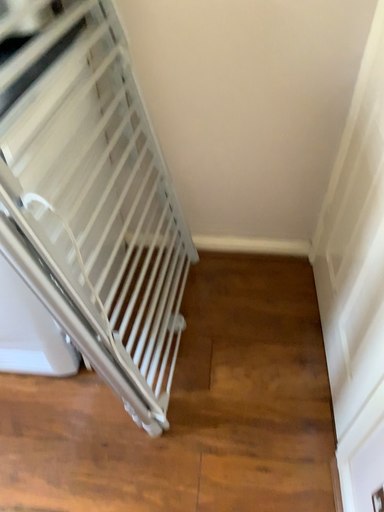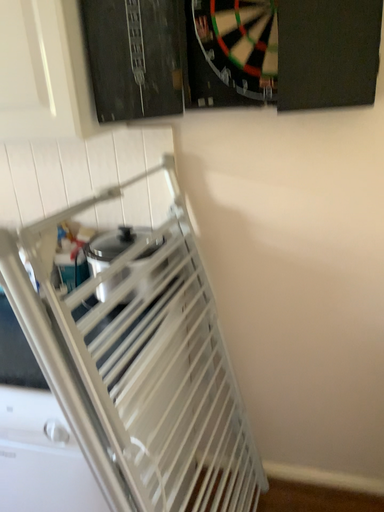
Question: How did the camera likely rotate when shooting the video?

Choices:
 (A) rotated left
 (B) rotated right

Answer: (A)